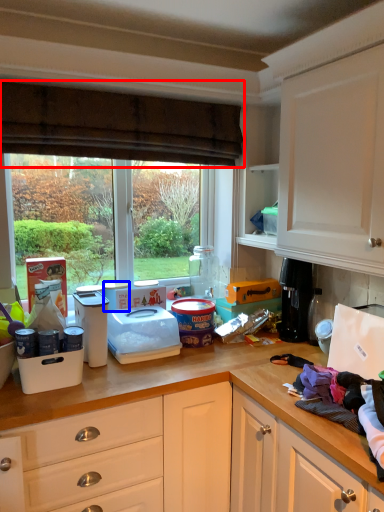
Question: Which object appears closest to the camera in this image, curtain (highlighted by a red box) or appliance (highlighted by a blue box)?

Choices:
 (A) curtain
 (B) appliance

Answer: (A)